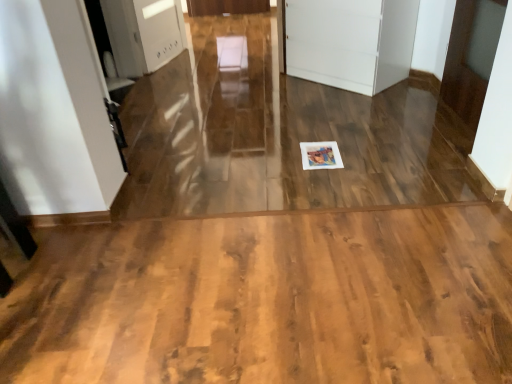
Where is `free spot in front of white glossy door at upper right, which is counted as the 1th door, starting from the right`? free spot in front of white glossy door at upper right, which is counted as the 1th door, starting from the right is located at coordinates (444, 148).